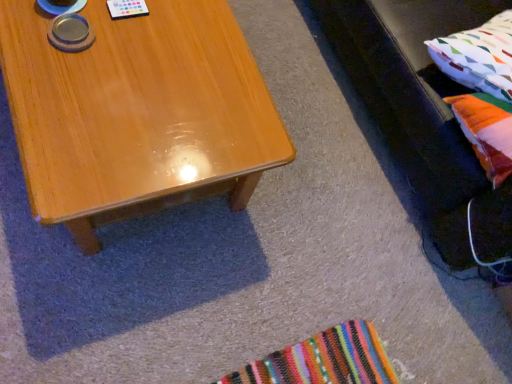
Question: Considering the relative positions of multicolored fabric pillow at right, which appears as the first pillow when viewed from the top, and velvet black couch at right in the image provided, is multicolored fabric pillow at right, which appears as the first pillow when viewed from the top, to the left of velvet black couch at right from the viewer's perspective?

Choices:
 (A) yes
 (B) no

Answer: (A)

Question: Considering the relative sizes of multicolored fabric pillow at right, which appears as the first pillow when viewed from the top, and velvet black couch at right in the image provided, is multicolored fabric pillow at right, which appears as the first pillow when viewed from the top, wider than velvet black couch at right?

Choices:
 (A) yes
 (B) no

Answer: (B)

Question: Is multicolored fabric pillow at right, which appears as the first pillow when viewed from the top, next to velvet black couch at right?

Choices:
 (A) no
 (B) yes

Answer: (A)

Question: From a real-world perspective, is multicolored fabric pillow at right, which appears as the first pillow when viewed from the top, positioned under velvet black couch at right based on gravity?

Choices:
 (A) yes
 (B) no

Answer: (B)

Question: Is multicolored fabric pillow at right, which is the second pillow in bottom-to-top order, not near velvet black couch at right?

Choices:
 (A) yes
 (B) no

Answer: (B)

Question: Considering the positions of multicolored fabric pillow at right, the first pillow when ordered from bottom to top, and multicolored fabric pillow at right, which appears as the first pillow when viewed from the top, in the image, is multicolored fabric pillow at right, the first pillow when ordered from bottom to top, bigger or smaller than multicolored fabric pillow at right, which appears as the first pillow when viewed from the top,?

Choices:
 (A) small
 (B) big

Answer: (A)

Question: From the image's perspective, relative to multicolored fabric pillow at right, which is the second pillow in bottom-to-top order, is multicolored fabric pillow at right, placed as the 2th pillow when sorted from top to bottom, above or below?

Choices:
 (A) above
 (B) below

Answer: (B)

Question: In terms of height, does multicolored fabric pillow at right, the first pillow when ordered from bottom to top, look taller or shorter compared to multicolored fabric pillow at right, which is the second pillow in bottom-to-top order?

Choices:
 (A) tall
 (B) short

Answer: (A)

Question: Which is correct: multicolored fabric pillow at right, placed as the 2th pillow when sorted from top to bottom, is inside multicolored fabric pillow at right, which is the second pillow in bottom-to-top order, or outside of it?

Choices:
 (A) outside
 (B) inside

Answer: (A)

Question: Choose the correct answer: Is shiny wood coffee table at center inside multicolored fabric pillow at right, the first pillow when ordered from bottom to top, or outside it?

Choices:
 (A) outside
 (B) inside

Answer: (A)

Question: Looking at the image, does shiny wood coffee table at center seem bigger or smaller compared to multicolored fabric pillow at right, the first pillow when ordered from bottom to top?

Choices:
 (A) big
 (B) small

Answer: (A)

Question: From a real-world perspective, is shiny wood coffee table at center positioned above or below multicolored fabric pillow at right, placed as the 2th pillow when sorted from top to bottom?

Choices:
 (A) below
 (B) above

Answer: (A)

Question: In terms of height, does shiny wood coffee table at center look taller or shorter compared to multicolored fabric pillow at right, the first pillow when ordered from bottom to top?

Choices:
 (A) short
 (B) tall

Answer: (B)

Question: In terms of height, does velvet black couch at right look taller or shorter compared to shiny wood coffee table at center?

Choices:
 (A) short
 (B) tall

Answer: (B)

Question: Choose the correct answer: Is velvet black couch at right inside shiny wood coffee table at center or outside it?

Choices:
 (A) inside
 (B) outside

Answer: (B)